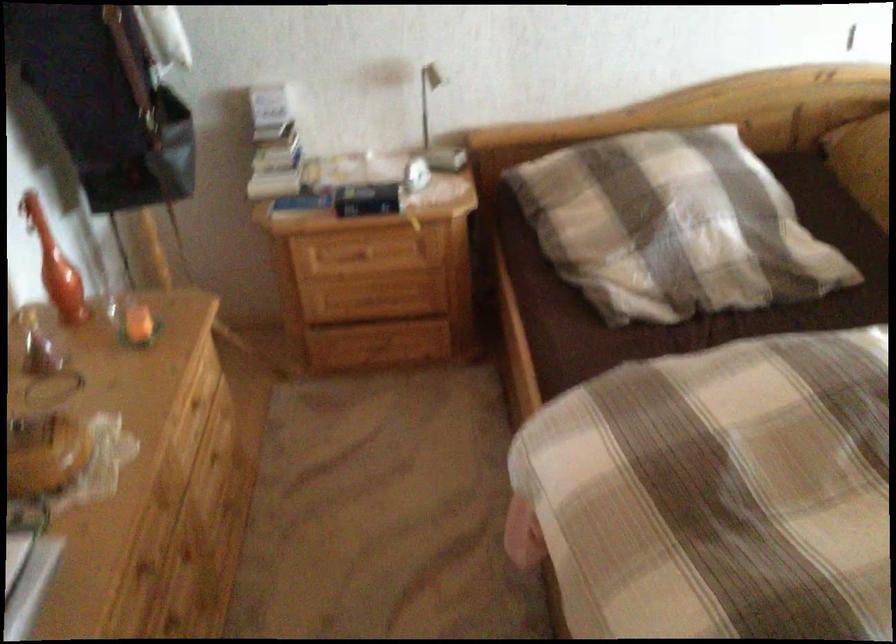
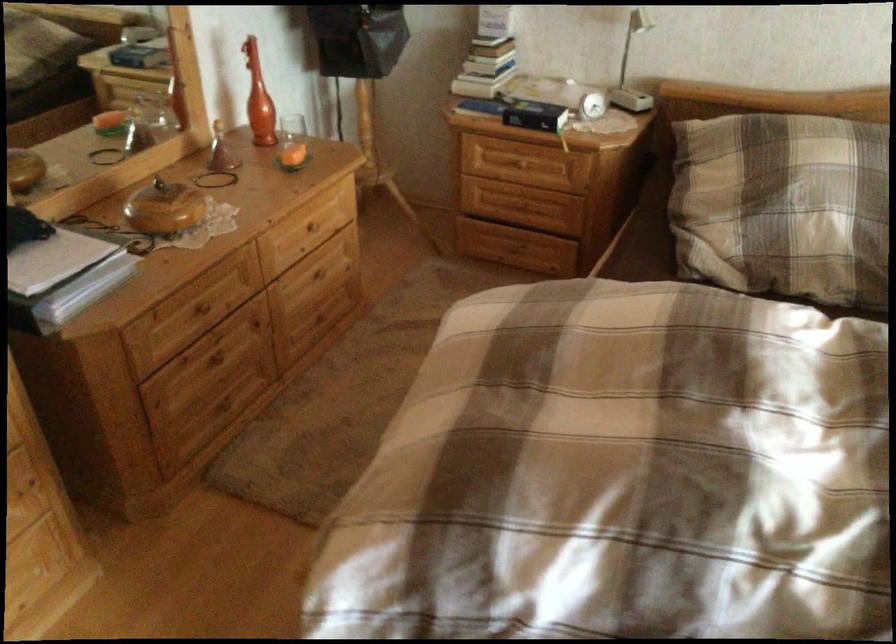
Where in the second image is the point corresponding to the point at 276,144 from the first image?

(487, 49)